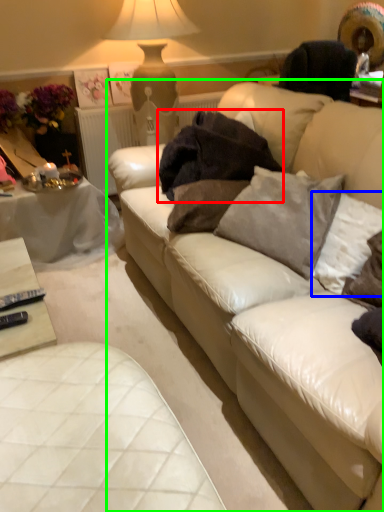
Question: Based on their relative distances, which object is farther from blanket (highlighted by a red box)? Choose from pillow (highlighted by a blue box) and studio couch (highlighted by a green box).

Choices:
 (A) pillow
 (B) studio couch

Answer: (A)